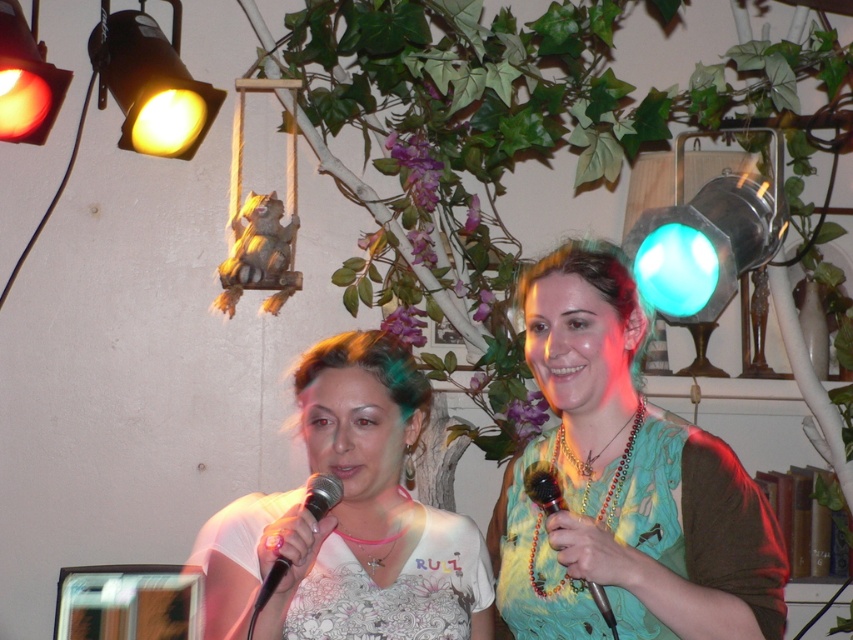
Does multicolored beaded necklace at upper right lie behind wooden beaded microphone at center?

No, multicolored beaded necklace at upper right is closer to the viewer.

In the scene shown: Is the position of multicolored beaded necklace at upper right less distant than that of wooden beaded microphone at center?

Yes, multicolored beaded necklace at upper right is in front of wooden beaded microphone at center.

Does point (614, 465) come in front of point (532, 480)?

That is False.

Find the location of a particular element. The width and height of the screenshot is (853, 640). multicolored beaded necklace at upper right is located at coordinates (624, 483).

Which is in front, point (680, 600) or point (456, 586)?

Positioned in front is point (680, 600).

The width and height of the screenshot is (853, 640). What are the coordinates of `multicolored beaded necklace at upper right` in the screenshot? It's located at (624, 483).

Locate an element on the screen. The height and width of the screenshot is (640, 853). multicolored beaded necklace at upper right is located at coordinates (x=624, y=483).

This screenshot has height=640, width=853. What do you see at coordinates (537, 566) in the screenshot?
I see `shiny green dress at right` at bounding box center [537, 566].

Is shiny green dress at right further to camera compared to matte orange spotlight at upper left?

No.

Which is in front, point (627, 522) or point (49, 92)?

Point (627, 522) is in front.

The width and height of the screenshot is (853, 640). I want to click on shiny green dress at right, so click(537, 566).